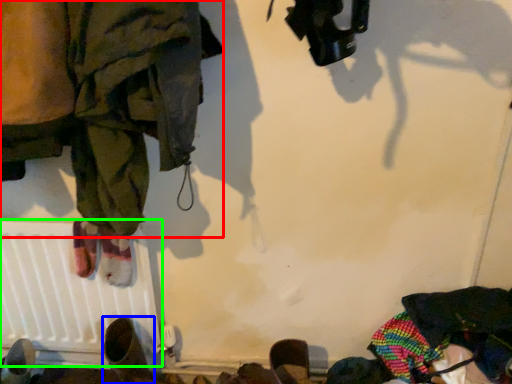
Question: Considering the real-world distances, which object is farthest from clothing (highlighted by a red box)? footwear (highlighted by a blue box) or radiator (highlighted by a green box)?

Choices:
 (A) footwear
 (B) radiator

Answer: (A)